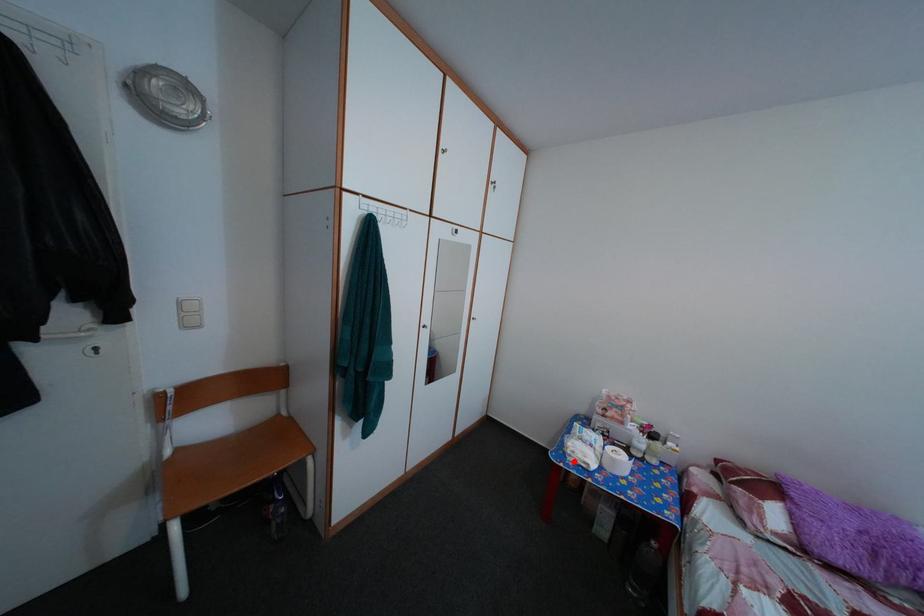
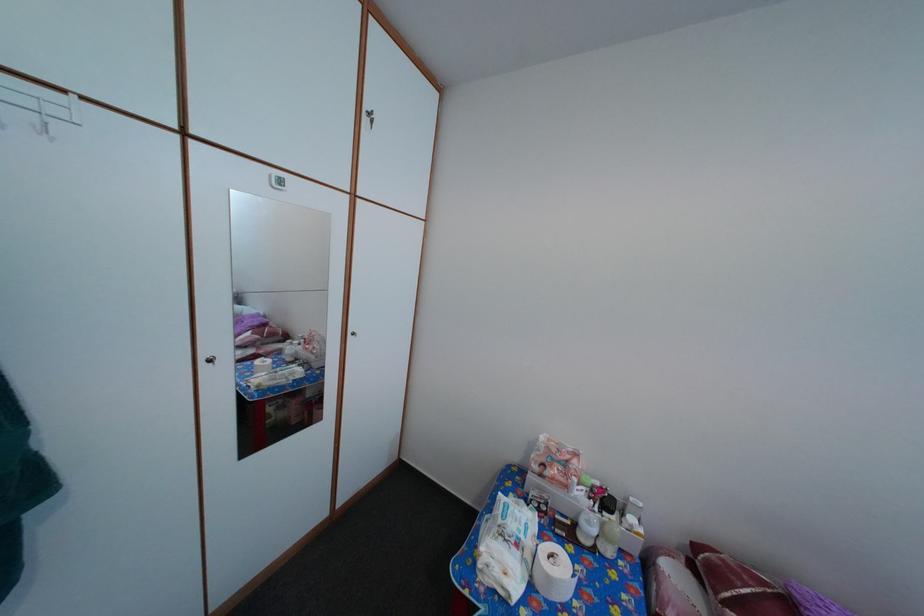
Locate, in the second image, the point that corresponds to the highlighted location in the first image.

(484, 572)